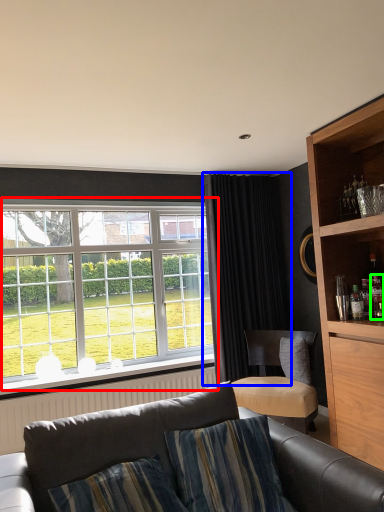
Question: Which object is the farthest from window (highlighted by a red box)? Choose among these: curtain (highlighted by a blue box) or bottle (highlighted by a green box).

Choices:
 (A) curtain
 (B) bottle

Answer: (B)